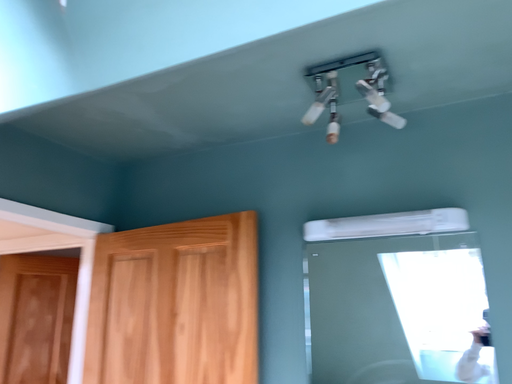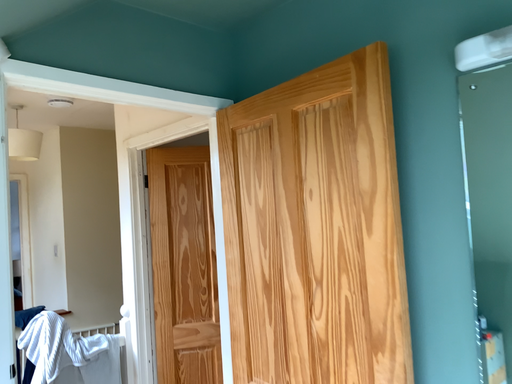
Question: How did the camera likely rotate when shooting the video?

Choices:
 (A) rotated downward
 (B) rotated upward

Answer: (A)